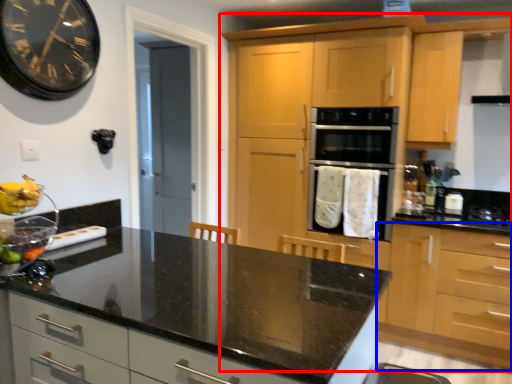
Question: Which object appears farthest to the camera in this image, cabinetry (highlighted by a red box) or cabinetry (highlighted by a blue box)?

Choices:
 (A) cabinetry
 (B) cabinetry

Answer: (A)